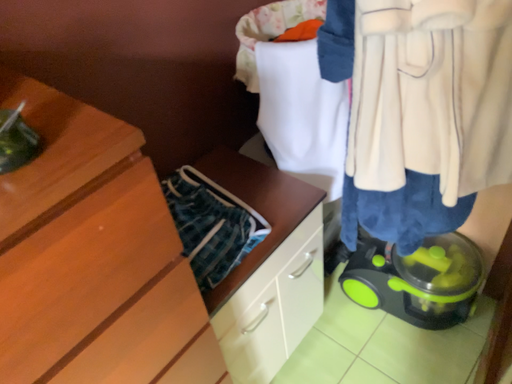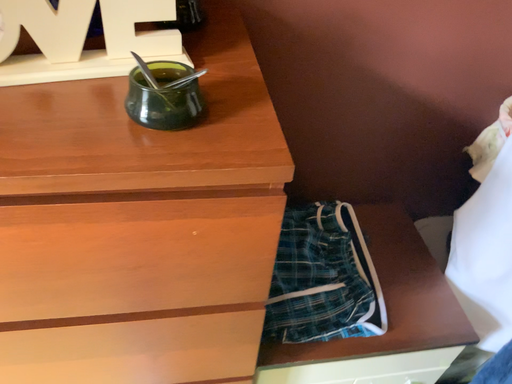
Question: How did the camera likely rotate when shooting the video?

Choices:
 (A) rotated upward
 (B) rotated downward

Answer: (A)